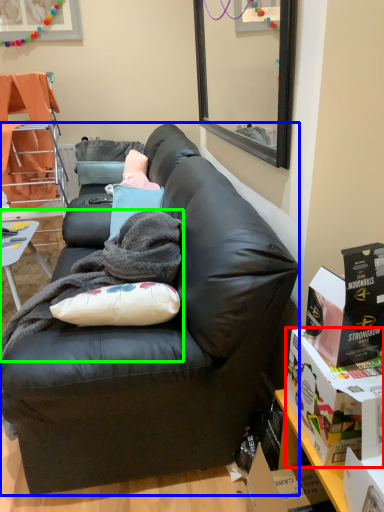
Question: Based on their relative distances, which object is farther from box (highlighted by a red box)? Choose from studio couch (highlighted by a blue box) and blanket (highlighted by a green box).

Choices:
 (A) studio couch
 (B) blanket

Answer: (B)